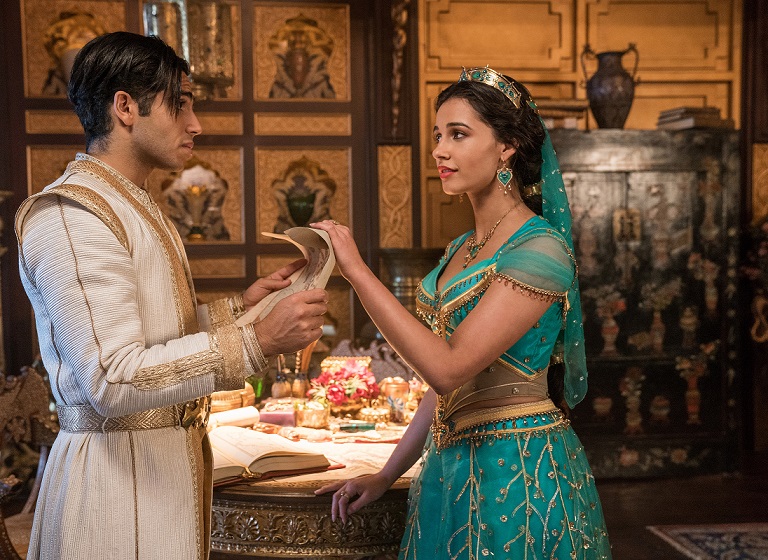
Find the location of a particular element. piece of paper is located at coordinates (313, 267).